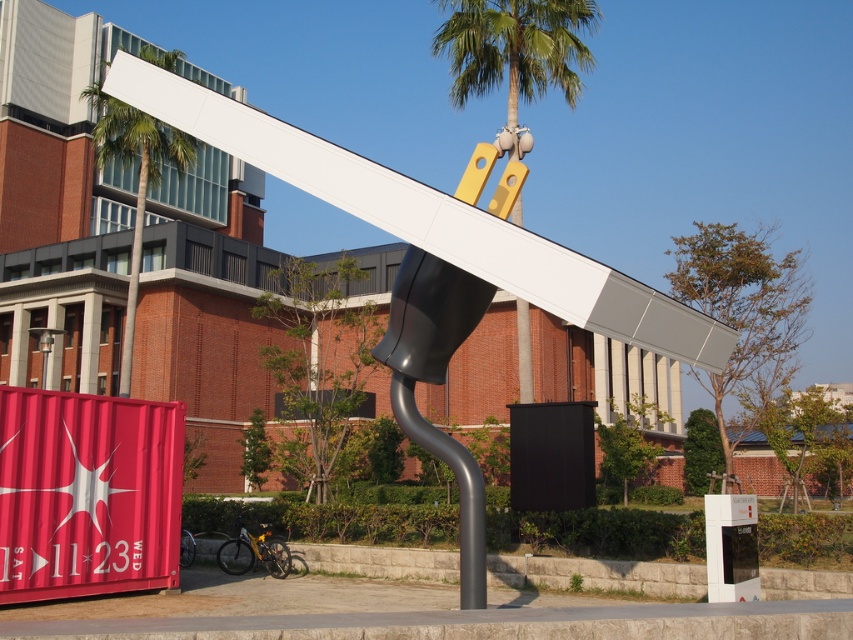
You are a photographer trying to capture both green leafy palm tree at upper center and green leafy palm tree at upper left in a single frame. Which palm tree should you focus on to ensure both are visible without moving the camera?

You should focus on the green leafy palm tree at upper left because it is smaller in size than the green leafy palm tree at upper center, allowing both to fit within the frame.